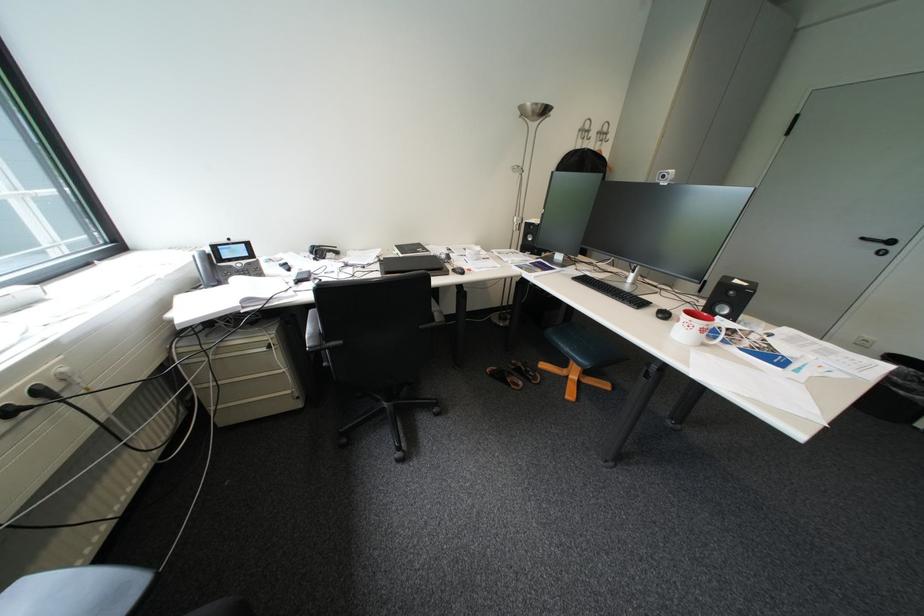
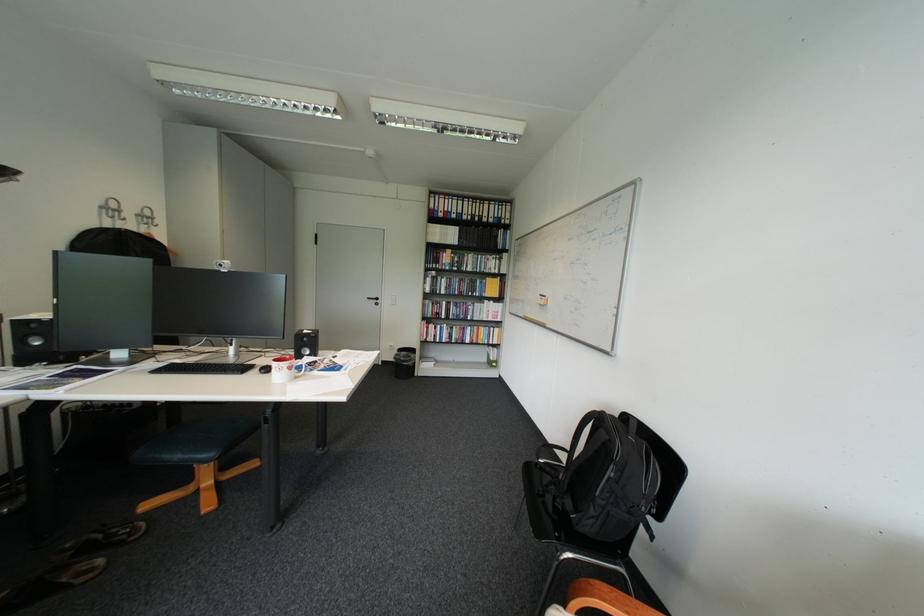
The point at (602, 140) is marked in the first image. Where is the corresponding point in the second image?

(137, 220)